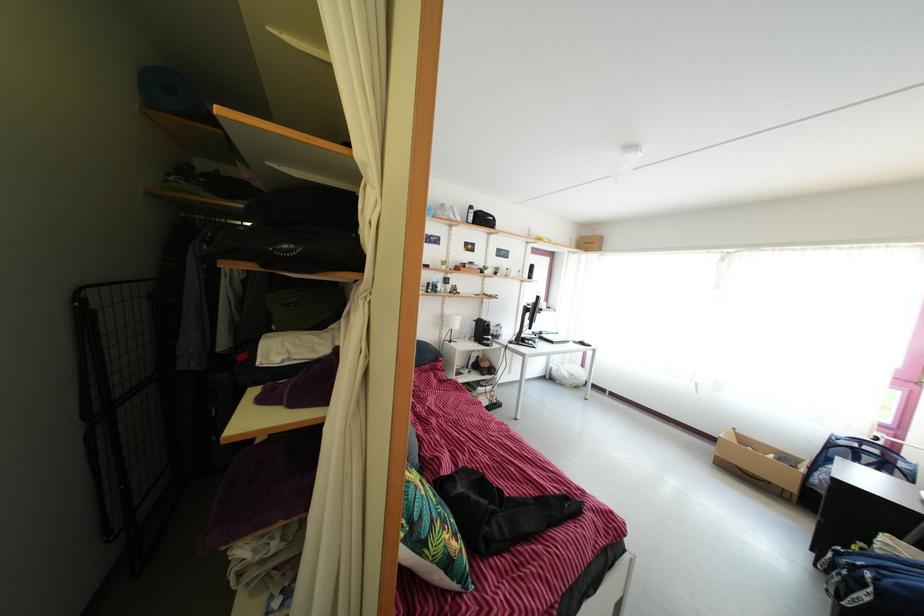
Where would you lift the white bottle? Please return your answer as a coordinate pair (x, y).

(468, 214)